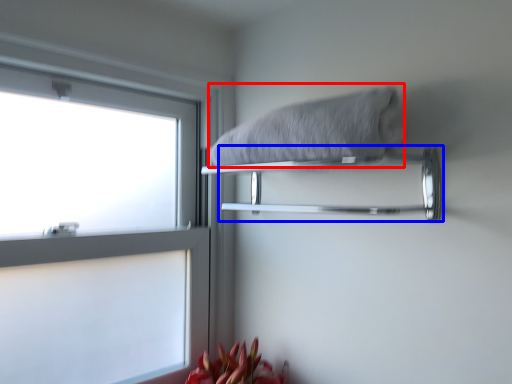
Question: Among these objects, which one is nearest to the camera, bath towel (highlighted by a red box) or towel bar (highlighted by a blue box)?

Choices:
 (A) bath towel
 (B) towel bar

Answer: (A)